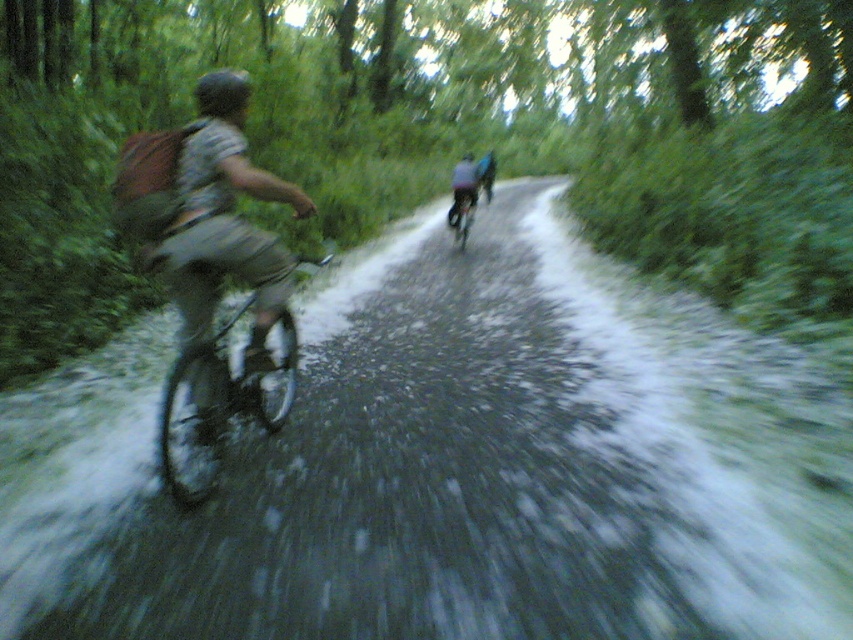
Who is more forward, (x=227, y=97) or (x=451, y=216)?

Positioned in front is point (x=227, y=97).

Identify the location of matte black helmet at upper center. (222, 92).

Does matte gray shorts at left have a lesser width compared to matte black helmet at upper center?

Yes, matte gray shorts at left is thinner than matte black helmet at upper center.

Is matte gray shorts at left shorter than matte black helmet at upper center?

Correct, matte gray shorts at left is not as tall as matte black helmet at upper center.

Which is in front, point (219, 406) or point (223, 80)?

Point (223, 80)

At what (x,y) coordinates should I click in order to perform the action: click on matte gray shorts at left. Please return your answer as a coordinate pair (x, y). The image size is (853, 640). Looking at the image, I should click on (225, 264).

Is metallic silver bicycle at left positioned in front of metallic silver bicycle at center?

Yes.

Does metallic silver bicycle at left have a greater width compared to metallic silver bicycle at center?

Yes, metallic silver bicycle at left is wider than metallic silver bicycle at center.

Does point (276, 404) lie behind point (451, 211)?

No, it is in front of (451, 211).

The width and height of the screenshot is (853, 640). Identify the location of metallic silver bicycle at left. (218, 404).